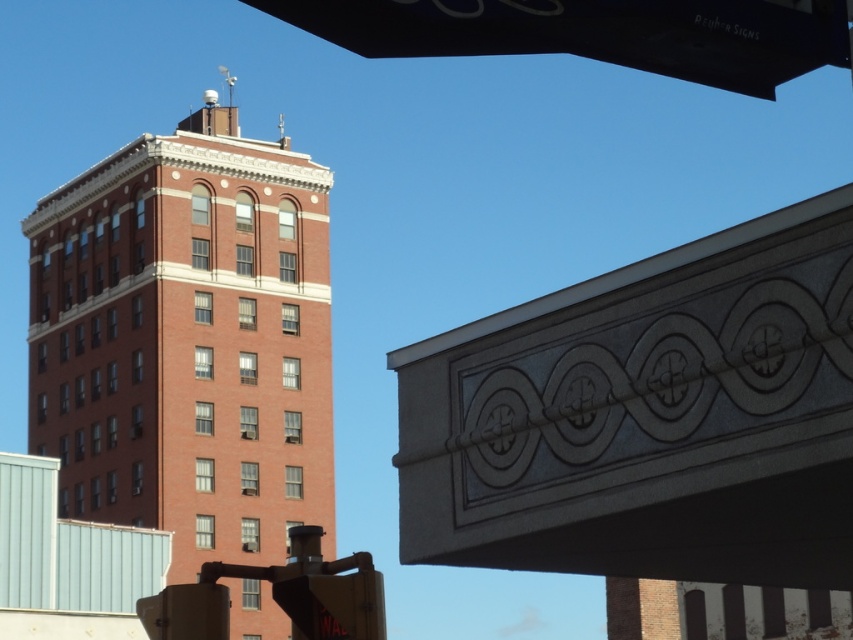
Question: Which of the following is the closest to the observer?

Choices:
 (A) metallic traffic light at lower left
 (B) brick building at left
 (C) metallic yellow traffic light at lower center

Answer: (C)

Question: Which of the following is the closest to the observer?

Choices:
 (A) (415, 19)
 (B) (334, 582)
 (C) (177, 596)

Answer: (C)

Question: Is brick building at left above metallic yellow traffic light at lower center?

Choices:
 (A) no
 (B) yes

Answer: (B)

Question: Does brick building at left come behind black plastic street sign at upper center?

Choices:
 (A) yes
 (B) no

Answer: (A)

Question: Can you confirm if brick building at left is positioned to the left of metallic yellow traffic light at lower center?

Choices:
 (A) yes
 (B) no

Answer: (A)

Question: Which object is farther from the camera taking this photo?

Choices:
 (A) metallic traffic light at lower left
 (B) metallic yellow traffic light at lower center
 (C) black plastic street sign at upper center

Answer: (C)